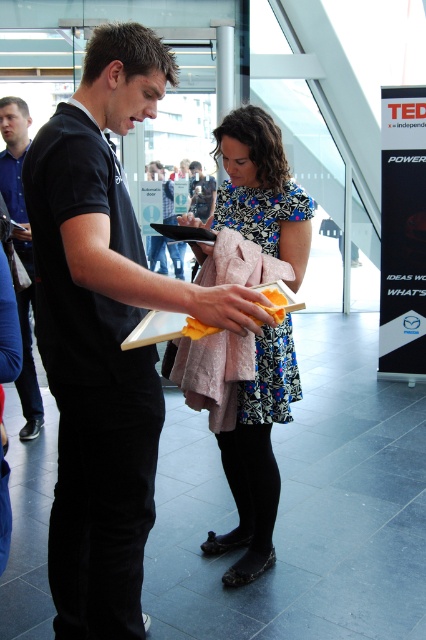
Question: Does floral dress at center appear on the left side of blue shirt at left?

Choices:
 (A) yes
 (B) no

Answer: (B)

Question: Which object is the closest to the floral dress at center?

Choices:
 (A) blue shirt at left
 (B) black matte shirt at center

Answer: (B)

Question: Is black matte shirt at center above blue shirt at left?

Choices:
 (A) yes
 (B) no

Answer: (B)

Question: Among these objects, which one is farthest from the camera?

Choices:
 (A) black matte shirt at center
 (B) floral dress at center
 (C) blue shirt at left

Answer: (C)

Question: Does black matte shirt at center appear on the left side of blue shirt at left?

Choices:
 (A) no
 (B) yes

Answer: (A)

Question: Which point is closer to the camera?

Choices:
 (A) (40, 282)
 (B) (244, 579)

Answer: (A)